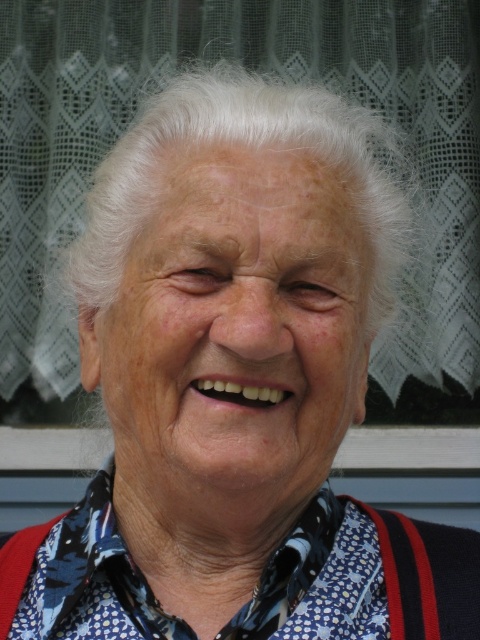
In the scene, you see the white matte face at center and the blue printed fabric shirt at center. Which object takes up more space in the image?

The white matte face at center is bigger than the blue printed fabric shirt at center, so it takes up more space in the image.

You are a fashion designer who wants to create a new outfit using the blue printed fabric shirt at center and the dry skin at center. Since you need to know their sizes, can you tell me which one is wider?

The blue printed fabric shirt at center is wider than the dry skin at center.

You are a photographer adjusting the camera focus. The subject is wearing a blue printed fabric shirt at center and there is a transparent glass window at upper center in the background. If you want to focus on the subject, should you adjust the focus closer or farther than 90.52 centimeters from the camera?

The transparent glass window at upper center is 90.52 centimeters away from the blue printed fabric shirt at center. To focus on the subject wearing the blue printed fabric shirt at center, you should adjust the focus closer than 90.52 centimeters from the camera.